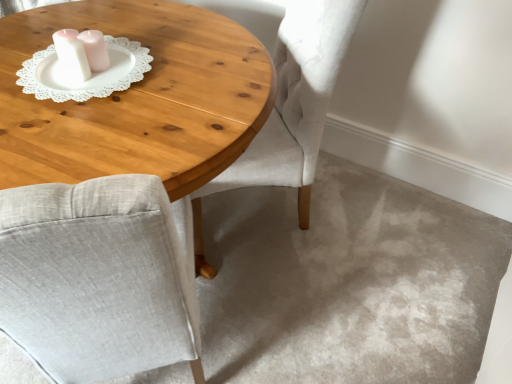
At what (x,y) coordinates should I click in order to perform the action: click on free location to the right of white lace doily at upper left. Please return your answer as a coordinate pair (x, y). Looking at the image, I should click on (150, 65).